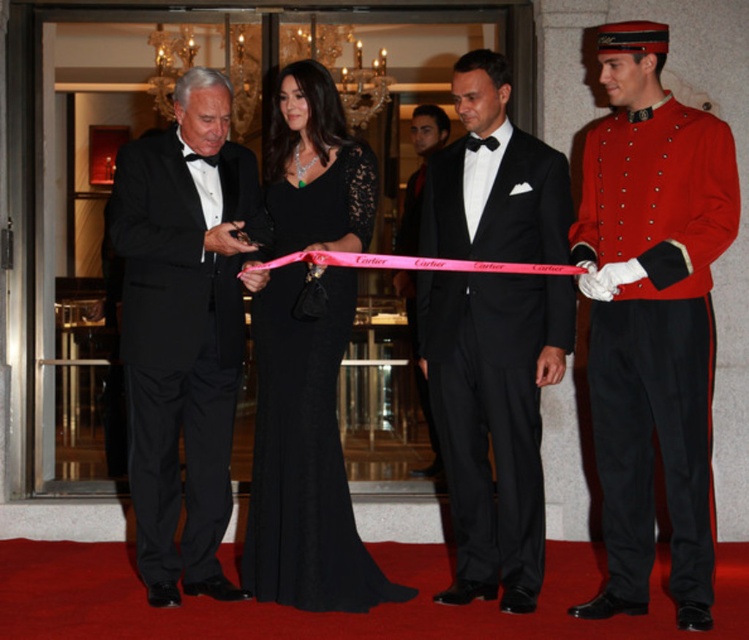
How distant is black satin tuxedo at center from black lace dress at center?

black satin tuxedo at center and black lace dress at center are 26.83 inches apart from each other.

Who is more forward, (467, 566) or (318, 163)?

Point (467, 566)

Find the location of a particular element. Image resolution: width=749 pixels, height=640 pixels. black satin tuxedo at center is located at coordinates (494, 419).

Is red cotton uniform at right behind black satin suit at center?

No, it is in front of black satin suit at center.

Can you confirm if red cotton uniform at right is positioned above black satin suit at center?

Incorrect, red cotton uniform at right is not positioned above black satin suit at center.

At what (x,y) coordinates should I click in order to perform the action: click on red cotton uniform at right. Please return your answer as a coordinate pair (x, y). Looking at the image, I should click on (654, 330).

Is point (640, 168) less distant than point (515, 582)?

Yes, it is.

Can you confirm if red cotton uniform at right is positioned to the right of black satin tuxedo at center?

Indeed, red cotton uniform at right is positioned on the right side of black satin tuxedo at center.

I want to click on red cotton uniform at right, so click(x=654, y=330).